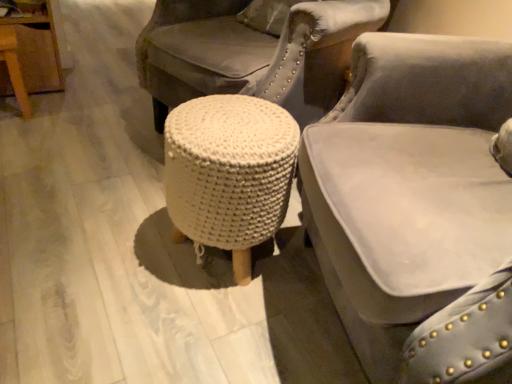
Describe the element at coordinates (229, 173) in the screenshot. This screenshot has height=384, width=512. I see `white knitted stool at center` at that location.

Identify the location of white knitted stool at center. The height and width of the screenshot is (384, 512). (229, 173).

Locate an element on the screen. Image resolution: width=512 pixels, height=384 pixels. velvet gray chair at center is located at coordinates coord(408,185).

Consider the image. What is the approximate height of velvet gray chair at center?

It is 31.28 inches.

This screenshot has width=512, height=384. Describe the element at coordinates (408, 185) in the screenshot. I see `velvet gray chair at center` at that location.

The height and width of the screenshot is (384, 512). Find the location of `white knitted stool at center`. white knitted stool at center is located at coordinates (229, 173).

Does velvet gray chair at center appear on the left side of white knitted stool at center?

Incorrect, velvet gray chair at center is not on the left side of white knitted stool at center.

Is velvet gray chair at center closer to the viewer compared to white knitted stool at center?

Yes, it is in front of white knitted stool at center.

Which point is more distant from viewer, (483,235) or (242,264)?

Positioned behind is point (242,264).

From the image's perspective, which one is positioned higher, velvet gray chair at center or white knitted stool at center?

From the image's view, white knitted stool at center is above.

From a real-world perspective, between velvet gray chair at center and white knitted stool at center, who is vertically lower?

white knitted stool at center is physically lower.

In terms of width, does velvet gray chair at center look wider or thinner when compared to white knitted stool at center?

In the image, velvet gray chair at center appears to be wider than white knitted stool at center.

Does velvet gray chair at center have a lesser height compared to white knitted stool at center?

Incorrect, the height of velvet gray chair at center does not fall short of that of white knitted stool at center.

Between velvet gray chair at center and white knitted stool at center, which one has larger size?

With larger size is velvet gray chair at center.

Is velvet gray chair at center completely or partially outside of white knitted stool at center?

Yes.

Would you say velvet gray chair at center is a long distance from white knitted stool at center?

That's not correct — velvet gray chair at center is a little close to white knitted stool at center.

Consider the image. Is velvet gray chair at center turned away from white knitted stool at center?

velvet gray chair at center does not have its back to white knitted stool at center.

The height and width of the screenshot is (384, 512). Find the location of `stool that is under the velvet gray chair at center (from a real-world perspective)`. stool that is under the velvet gray chair at center (from a real-world perspective) is located at coordinates (229, 173).

Which object is positioned more to the right, white knitted stool at center or velvet gray chair at center?

velvet gray chair at center is more to the right.

Is white knitted stool at center positioned in front of velvet gray chair at center?

No.

Which is farther from the camera, (198, 157) or (316, 173)?

The point (198, 157) is more distant.

From the image's perspective, is white knitted stool at center beneath velvet gray chair at center?

No, from the image's perspective, white knitted stool at center is not below velvet gray chair at center.

From a real-world perspective, is white knitted stool at center on velvet gray chair at center?

No, from a real-world perspective, white knitted stool at center is not over velvet gray chair at center

Between white knitted stool at center and velvet gray chair at center, which one has larger width?

velvet gray chair at center.

Between white knitted stool at center and velvet gray chair at center, which one has less height?

white knitted stool at center is shorter.

Considering the relative sizes of white knitted stool at center and velvet gray chair at center in the image provided, is white knitted stool at center smaller than velvet gray chair at center?

Yes.

Is white knitted stool at center completely or partially outside of velvet gray chair at center?

Absolutely, white knitted stool at center is external to velvet gray chair at center.

Is white knitted stool at center with velvet gray chair at center?

No, white knitted stool at center is not beside velvet gray chair at center.

Is white knitted stool at center facing towards velvet gray chair at center?

No, white knitted stool at center does not turn towards velvet gray chair at center.

How different are the orientations of white knitted stool at center and velvet gray chair at center in degrees?

There is a 14.9-degree angle between the facing directions of white knitted stool at center and velvet gray chair at center.

Measure the distance from white knitted stool at center to velvet gray chair at center.

They are 9.85 inches apart.

The image size is (512, 384). What are the coordinates of `chair on the right of white knitted stool at center` in the screenshot? It's located at (408, 185).

This screenshot has height=384, width=512. I want to click on stool above the velvet gray chair at center (from the image's perspective), so click(229, 173).

At what (x,y) coordinates should I click in order to perform the action: click on chair that appears in front of the white knitted stool at center. Please return your answer as a coordinate pair (x, y). Image resolution: width=512 pixels, height=384 pixels. Looking at the image, I should click on (408, 185).